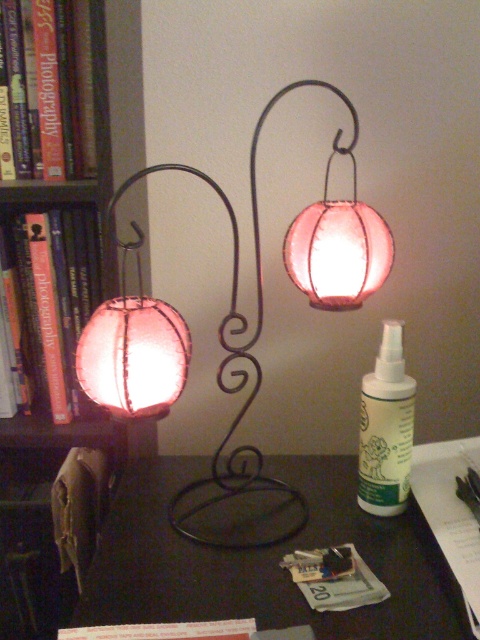
You are organizing a small space and want to place both the matte wood bookshelf at left and the matte glass lantern at center. Given their sizes, which object should you place first to ensure they both fit?

The matte wood bookshelf at left occupies less space than the matte glass lantern at center, so you should place the matte glass lantern at center first to ensure there is enough space for both objects.

You are organizing a small event and need to place a 15 cm tall candle holder on the black matte table at center. Considering the height of the matte wood bookshelf at left, will the candle holder be visible from the front of the table?

The black matte table at center is not as tall as the matte wood bookshelf at left, so the candle holder placed on the table may be partially obscured by the bookshelf if it is positioned in front of the table. Ensure there is enough clearance between the bookshelf and the table for visibility.

You are standing in front of the decorative metal stand with two lanterns. You notice two points marked on the floor. The first point is at coordinate point(50, 547) and the second is at point(225, 499). From your perspective, which point is closer to you?

Point(225, 499) is closer to you because point(50, 547) is behind it.